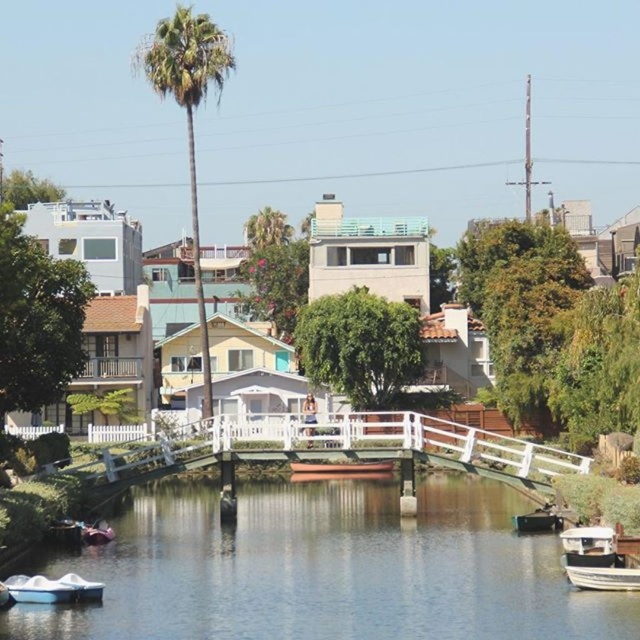
Question: Where is green leafy palm tree at upper left located in relation to white matte boat at lower right in the image?

Choices:
 (A) below
 (B) above

Answer: (B)

Question: Can you confirm if white glossy boat at lower right is wider than white matte boat at lower right?

Choices:
 (A) no
 (B) yes

Answer: (A)

Question: From the image, what is the correct spatial relationship of white matte boat at lower right in relation to wooden boat at center?

Choices:
 (A) below
 (B) above

Answer: (B)

Question: Estimate the real-world distances between objects in this image. Which object is closer to the white matte boat at lower right?

Choices:
 (A) wooden boat at center
 (B) clear water at center
 (C) green leafy palm tree at upper left
 (D) white matte boat at lower left

Answer: (B)

Question: Which point is farther from the camera taking this photo?

Choices:
 (A) (596, 540)
 (B) (12, 582)
 (C) (333, 467)

Answer: (C)

Question: Which point appears farthest from the camera in this image?

Choices:
 (A) (584, 556)
 (B) (48, 579)
 (C) (380, 464)
 (D) (634, 570)

Answer: (C)